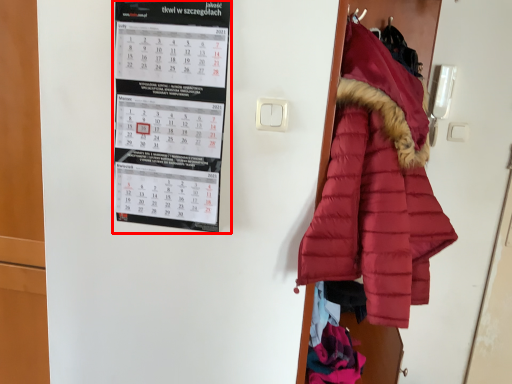
Question: Observing the image, what is the correct spatial positioning of bulletin board (annotated by the red box) in reference to coat?

Choices:
 (A) right
 (B) left

Answer: (B)